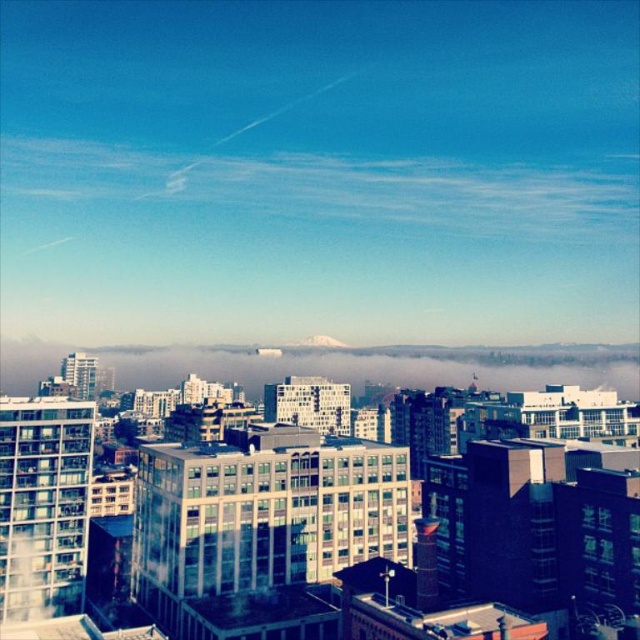
Question: Is white translucent fog at center above white snow-covered mountain at center?

Choices:
 (A) no
 (B) yes

Answer: (A)

Question: Which of these objects is positioned closest to the white snow-covered mountain at center?

Choices:
 (A) white wispy cloud at upper center
 (B) white translucent fog at center

Answer: (B)

Question: Is white wispy cloud at upper center smaller than white snow-covered mountain at center?

Choices:
 (A) yes
 (B) no

Answer: (B)

Question: Estimate the real-world distances between objects in this image. Which object is closer to the white wispy cloud at upper center?

Choices:
 (A) white translucent fog at center
 (B) white snow-covered mountain at center

Answer: (A)

Question: Is white translucent fog at center to the left of white snow-covered mountain at center from the viewer's perspective?

Choices:
 (A) no
 (B) yes

Answer: (B)

Question: Which point is farther from the camera taking this photo?

Choices:
 (A) (614, 172)
 (B) (632, 356)
 (C) (307, 340)

Answer: (A)